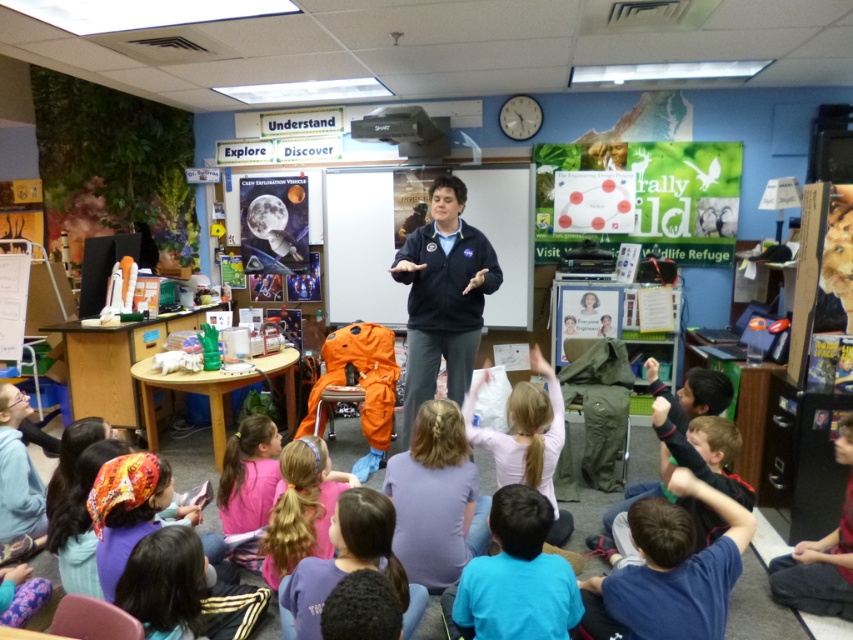
Question: Which object appears farthest from the camera in this image?

Choices:
 (A) dark blue jacket at center
 (B) pink fabric ponytail at lower center
 (C) whiteboard at center

Answer: (C)

Question: Is pink fabric shirt at center bigger than dark blue jeans at lower right?

Choices:
 (A) yes
 (B) no

Answer: (A)

Question: Which object is the closest to the pink fabric ponytail at lower center?

Choices:
 (A) whiteboard at center
 (B) purple cotton shirt at lower center

Answer: (B)

Question: Is dark blue jacket at center thinner than dark blue jeans at lower right?

Choices:
 (A) no
 (B) yes

Answer: (A)

Question: Among these points, which one is farthest from the camera?

Choices:
 (A) (276, 534)
 (B) (529, 358)

Answer: (B)

Question: Is the position of whiteboard at center more distant than that of pink fabric shirt at center?

Choices:
 (A) yes
 (B) no

Answer: (A)